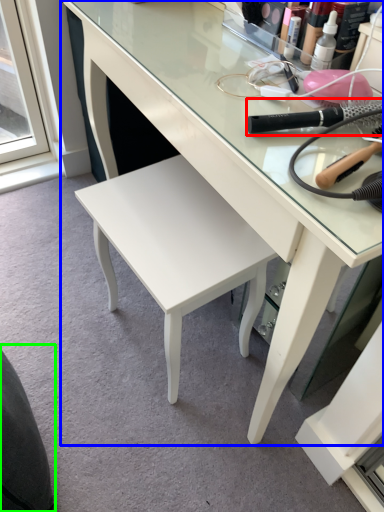
Question: Estimate the real-world distances between objects in this image. Which object is farther from brush (highlighted by a red box), desk (highlighted by a blue box) or swivel chair (highlighted by a green box)?

Choices:
 (A) desk
 (B) swivel chair

Answer: (B)